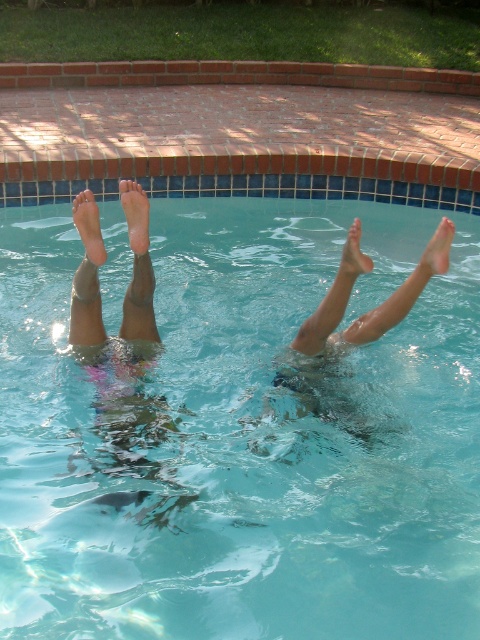
Which of these two, skinny legs at center or pale skin foot at lower center, stands taller?

With more height is skinny legs at center.

Between point (84, 298) and point (140, 220), which one is positioned in front?

Positioned in front is point (140, 220).

What are the coordinates of `skinny legs at center` in the screenshot? It's located at (120, 332).

How distant is clear glass water at center from pale skin foot at lower center?

clear glass water at center is 1.87 meters away from pale skin foot at lower center.

In the scene shown: Is clear glass water at center in front of pale skin foot at lower center?

Yes, clear glass water at center is in front of pale skin foot at lower center.

I want to click on clear glass water at center, so click(x=240, y=435).

Between skinny legs at center and smooth skin legs at upper center, which one appears on the right side from the viewer's perspective?

smooth skin legs at upper center is more to the right.

Which is below, skinny legs at center or smooth skin legs at upper center?

smooth skin legs at upper center is lower down.

This screenshot has width=480, height=640. Identify the location of skinny legs at center. (120, 332).